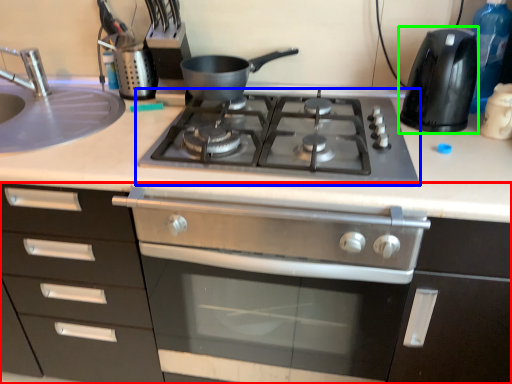
Question: Based on their relative distances, which object is farther from cabinetry (highlighted by a red box)? Choose from gas stove (highlighted by a blue box) and kitchen appliance (highlighted by a green box).

Choices:
 (A) gas stove
 (B) kitchen appliance

Answer: (B)